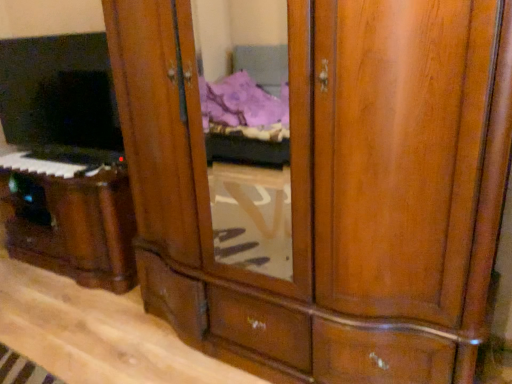
Question: From a real-world perspective, is matte black tv at left on top of matte black keyboard at left?

Choices:
 (A) no
 (B) yes

Answer: (B)

Question: From the image's perspective, is matte black tv at left under matte black keyboard at left?

Choices:
 (A) yes
 (B) no

Answer: (B)

Question: Is matte black tv at left in contact with matte black keyboard at left?

Choices:
 (A) yes
 (B) no

Answer: (B)

Question: Is matte black keyboard at left inside matte black tv at left?

Choices:
 (A) yes
 (B) no

Answer: (B)

Question: Is matte black tv at left positioned with its back to matte black keyboard at left?

Choices:
 (A) yes
 (B) no

Answer: (B)

Question: Is wooden piano at lower left to the left or to the right of matte black tv at left in the image?

Choices:
 (A) right
 (B) left

Answer: (A)

Question: Does point (110, 221) appear closer or farther from the camera than point (29, 61)?

Choices:
 (A) farther
 (B) closer

Answer: (B)

Question: From the image's perspective, is wooden piano at lower left above or below matte black tv at left?

Choices:
 (A) above
 (B) below

Answer: (B)

Question: Considering the positions of wooden piano at lower left and matte black tv at left in the image, is wooden piano at lower left bigger or smaller than matte black tv at left?

Choices:
 (A) small
 (B) big

Answer: (B)

Question: Considering the positions of matte black tv at left and matte black keyboard at left in the image, is matte black tv at left bigger or smaller than matte black keyboard at left?

Choices:
 (A) small
 (B) big

Answer: (B)

Question: Is matte black tv at left spatially inside matte black keyboard at left, or outside of it?

Choices:
 (A) outside
 (B) inside

Answer: (A)

Question: From the image's perspective, is matte black tv at left positioned above or below matte black keyboard at left?

Choices:
 (A) above
 (B) below

Answer: (A)

Question: From their relative heights in the image, would you say matte black tv at left is taller or shorter than matte black keyboard at left?

Choices:
 (A) tall
 (B) short

Answer: (A)

Question: Is matte black keyboard at left situated inside wooden piano at lower left or outside?

Choices:
 (A) outside
 (B) inside

Answer: (B)

Question: Is matte black keyboard at left wider or thinner than wooden piano at lower left?

Choices:
 (A) thin
 (B) wide

Answer: (A)